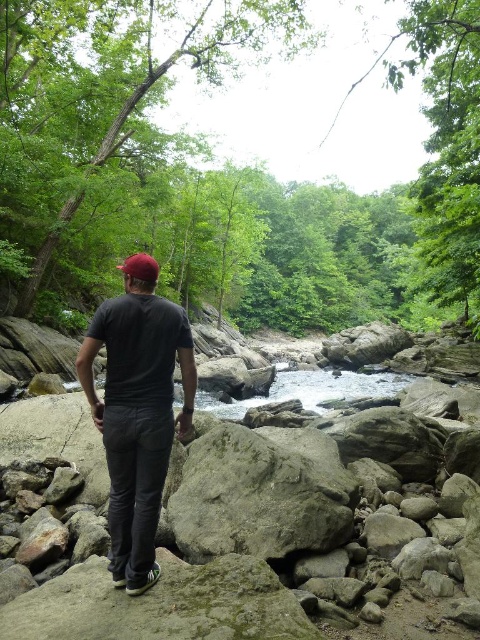
Question: Which point is farther to the camera?

Choices:
 (A) (148, 266)
 (B) (163, 358)

Answer: (A)

Question: Which point appears farthest from the camera in this image?

Choices:
 (A) (132, 278)
 (B) (98, 317)

Answer: (A)

Question: Among these objects, which one is nearest to the camera?

Choices:
 (A) red matte cap at center
 (B) dark gray cotton t-shirt at center

Answer: (B)

Question: Is dark gray cotton t-shirt at center above red matte cap at center?

Choices:
 (A) no
 (B) yes

Answer: (A)

Question: Can you confirm if dark gray cotton t-shirt at center is positioned to the left of red matte cap at center?

Choices:
 (A) yes
 (B) no

Answer: (B)

Question: Can you confirm if dark gray cotton t-shirt at center is positioned to the right of red matte cap at center?

Choices:
 (A) yes
 (B) no

Answer: (A)